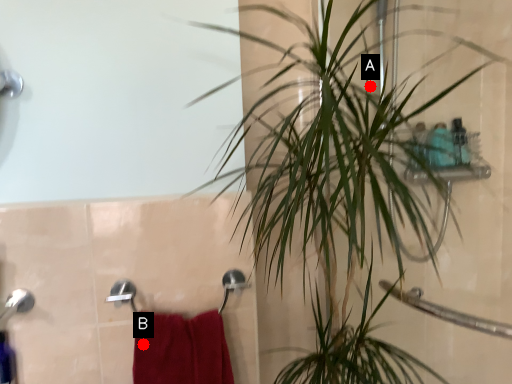
Question: Two points are circled on the image, labeled by A and B beside each circle. Among these points, which one is nearest to the camera?

Choices:
 (A) A is closer
 (B) B is closer

Answer: (B)